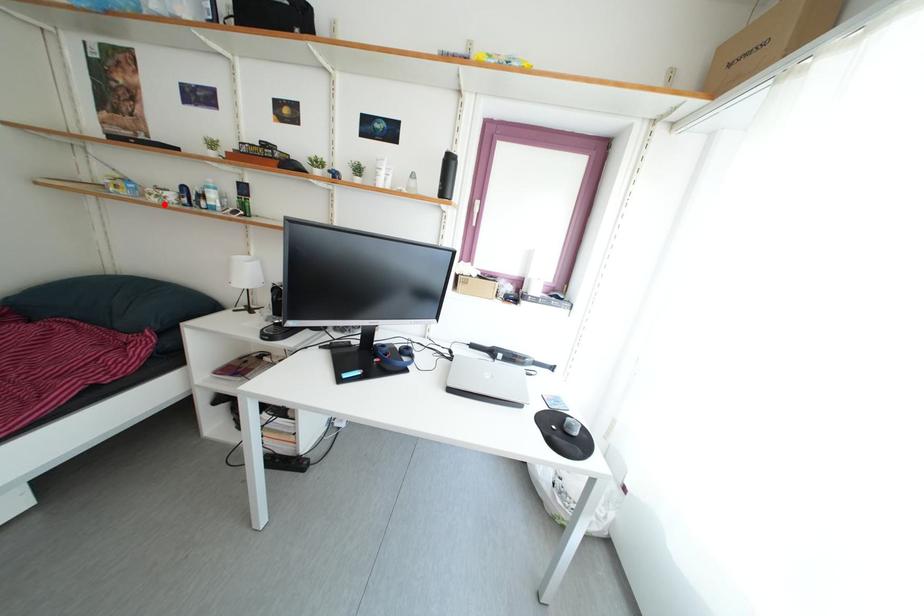
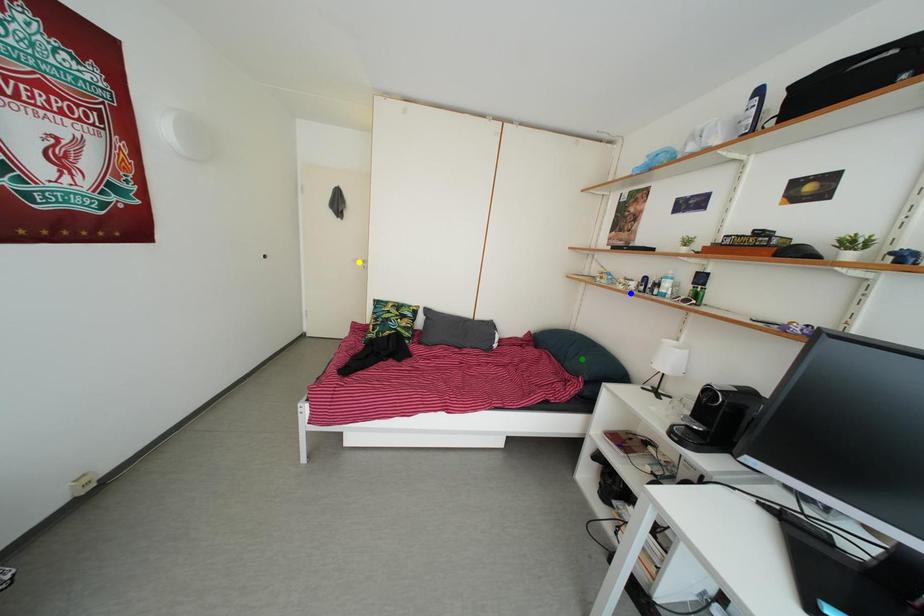
Question: I am providing you with two images of the same scene from different viewpoints. A red point is marked on the first image. You are given multiple points on the second image. In image 2, which mark is for the same physical point as the one in image 1?

Choices:
 (A) blue point
 (B) green point
 (C) yellow point

Answer: (A)